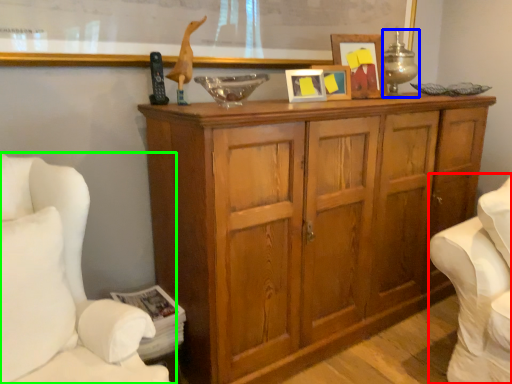
Question: Which object is the closest to the swivel chair (highlighted by a red box)? Choose among these: table lamp (highlighted by a blue box) or furniture (highlighted by a green box).

Choices:
 (A) table lamp
 (B) furniture

Answer: (A)